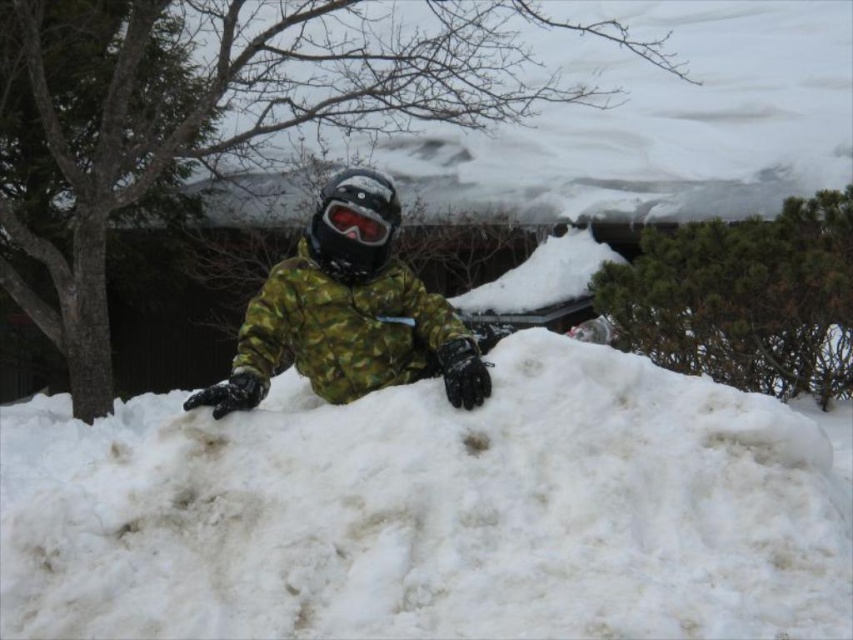
You are a photographer trying to capture the scene of the person in the snow. You notice the white fluffy snow at center and the matte black goggles at center. Which object would appear larger in your photo?

The white fluffy snow at center would appear larger in the photo because it is bigger than the matte black goggles at center.

You are a photographer planning to capture the scene with the white fluffy snow at center and the matte black goggles at center. Which object should you zoom in on to ensure the smaller one fills the frame better?

The matte black goggles at center are smaller than the white fluffy snow at center, so you should zoom in on the matte black goggles at center to make it fill the frame better.